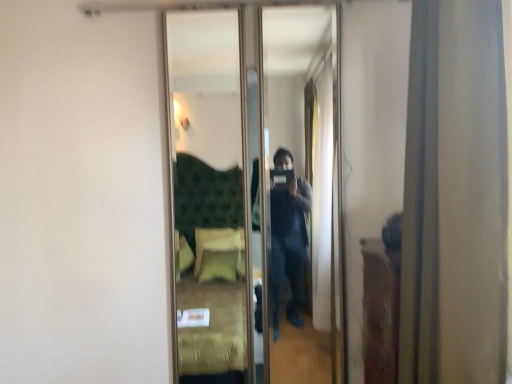
Question: Can you confirm if matte gold curtain at right is taller than clear glass mirror at center?

Choices:
 (A) yes
 (B) no

Answer: (B)

Question: Is matte gold curtain at right not near clear glass mirror at center?

Choices:
 (A) no
 (B) yes

Answer: (B)

Question: Is clear glass mirror at center at the back of matte gold curtain at right?

Choices:
 (A) yes
 (B) no

Answer: (B)

Question: Is matte gold curtain at right smaller than clear glass mirror at center?

Choices:
 (A) no
 (B) yes

Answer: (A)

Question: Is matte gold curtain at right at the right side of clear glass mirror at center?

Choices:
 (A) yes
 (B) no

Answer: (A)

Question: Is matte gold curtain at right oriented towards clear glass mirror at center?

Choices:
 (A) yes
 (B) no

Answer: (B)

Question: From a real-world perspective, is clear glass mirror at center physically below matte gold curtain at right?

Choices:
 (A) no
 (B) yes

Answer: (B)

Question: From the image's perspective, would you say clear glass mirror at center is positioned over matte gold curtain at right?

Choices:
 (A) no
 (B) yes

Answer: (A)

Question: From the image's perspective, is clear glass mirror at center beneath matte gold curtain at right?

Choices:
 (A) yes
 (B) no

Answer: (A)

Question: Is clear glass mirror at center facing towards matte gold curtain at right?

Choices:
 (A) no
 (B) yes

Answer: (B)

Question: Can you confirm if clear glass mirror at center is positioned to the right of matte gold curtain at right?

Choices:
 (A) yes
 (B) no

Answer: (B)

Question: Considering the relative sizes of clear glass mirror at center and matte gold curtain at right in the image provided, is clear glass mirror at center bigger than matte gold curtain at right?

Choices:
 (A) yes
 (B) no

Answer: (B)

Question: Is point (501, 226) closer or farther from the camera than point (202, 152)?

Choices:
 (A) closer
 (B) farther

Answer: (A)